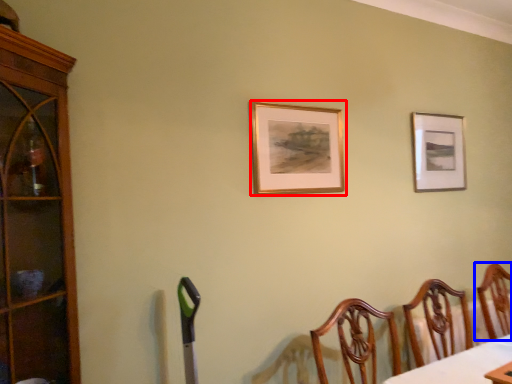
Question: Which of the following is the closest to the observer, picture frame (highlighted by a red box) or chair (highlighted by a blue box)?

Choices:
 (A) picture frame
 (B) chair

Answer: (A)